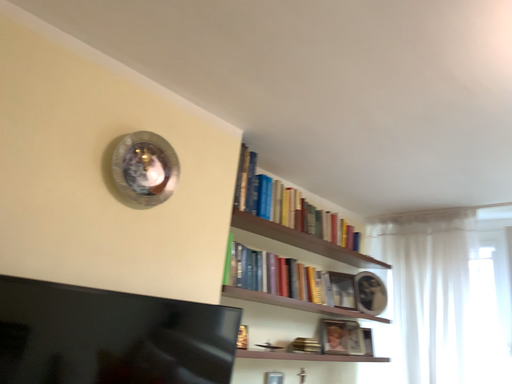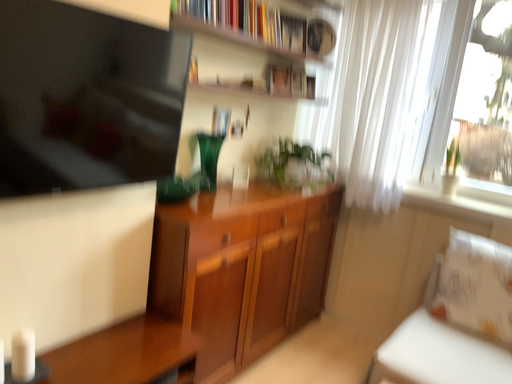
Question: Which way did the camera rotate in the video?

Choices:
 (A) rotated upward
 (B) rotated downward

Answer: (B)